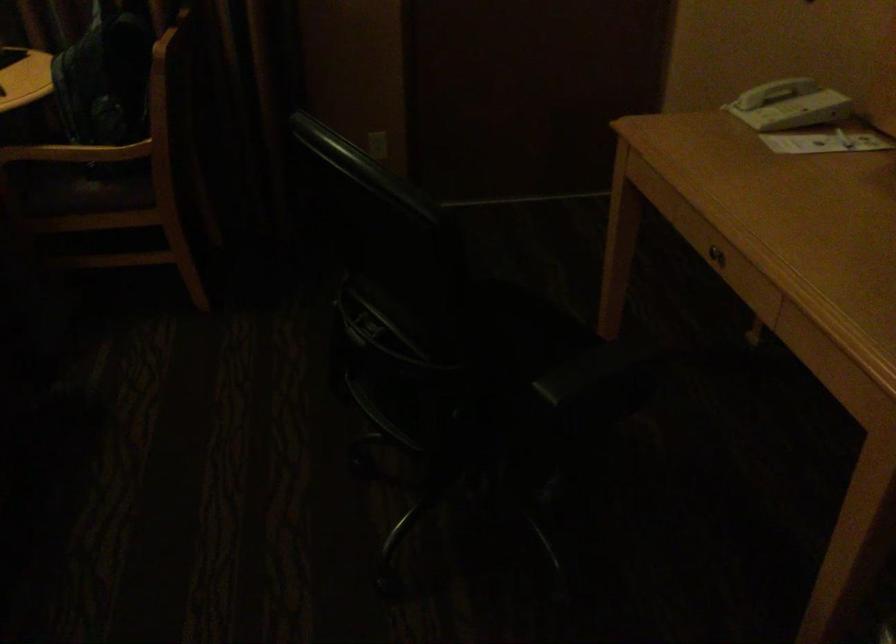
Describe the element at coordinates (768, 91) in the screenshot. I see `a white telephone handset` at that location.